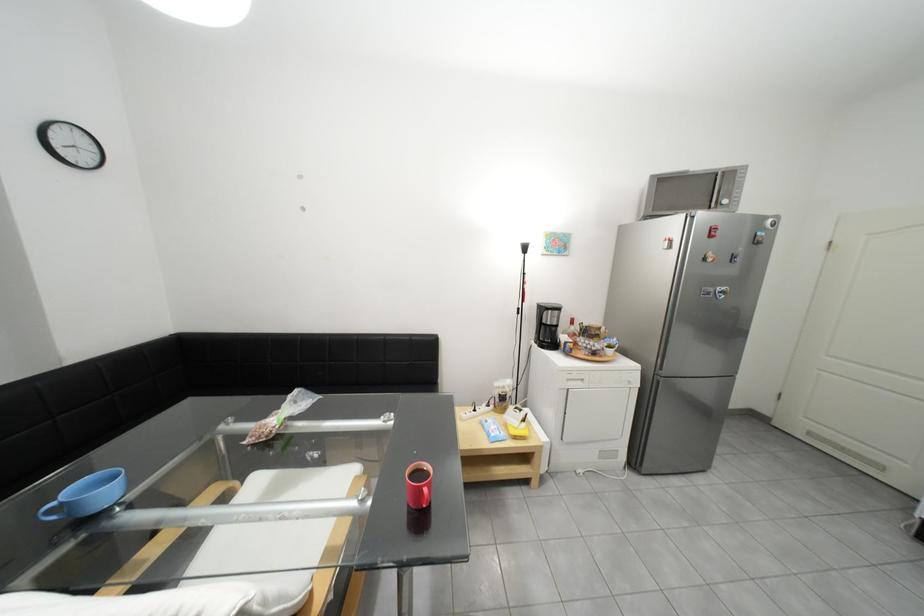
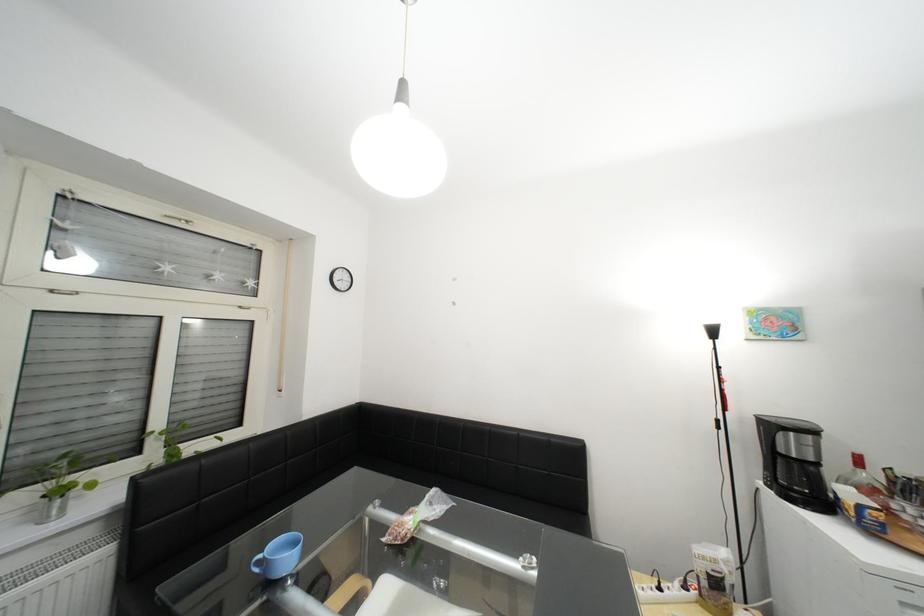
Find the pixel in the second image that matches point (584, 336) in the first image.

(881, 492)